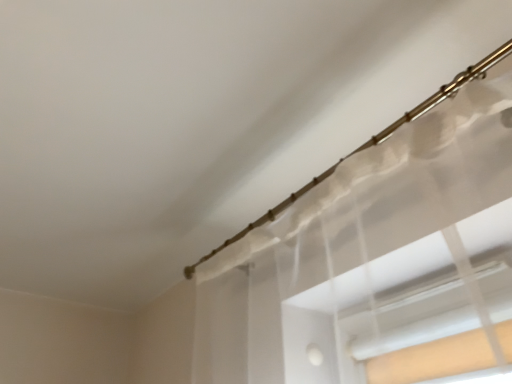
In order to face translucent fabric curtain at upper right, should I rotate leftwards or rightwards?

To align with it, rotate right about 8.255°.

What do you see at coordinates (377, 262) in the screenshot?
I see `translucent fabric curtain at upper right` at bounding box center [377, 262].

In the scene shown: What is the approximate width of translucent fabric curtain at upper right?

7.01 inches.

The width and height of the screenshot is (512, 384). I want to click on translucent fabric curtain at upper right, so click(377, 262).

Find the location of a particular element. translucent fabric curtain at upper right is located at coordinates (377, 262).